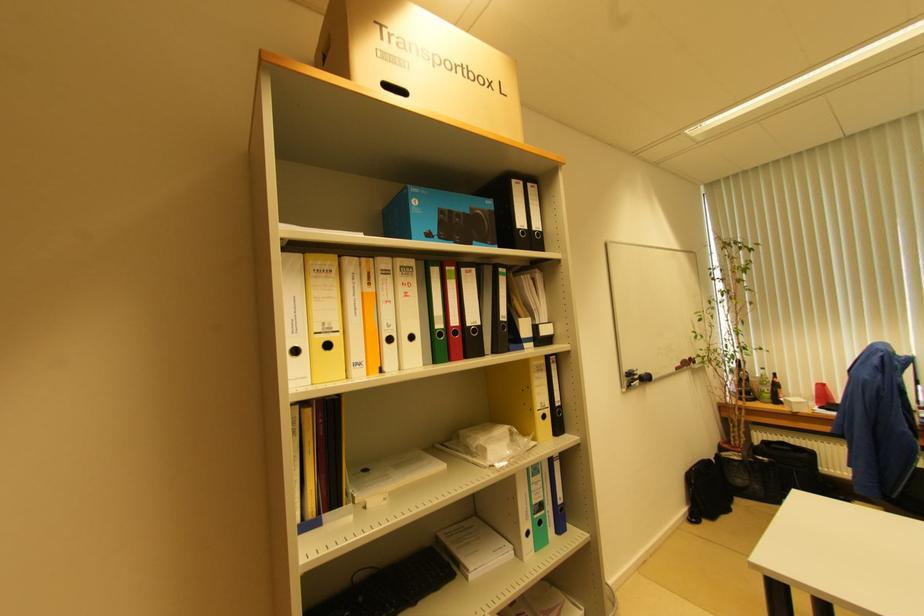
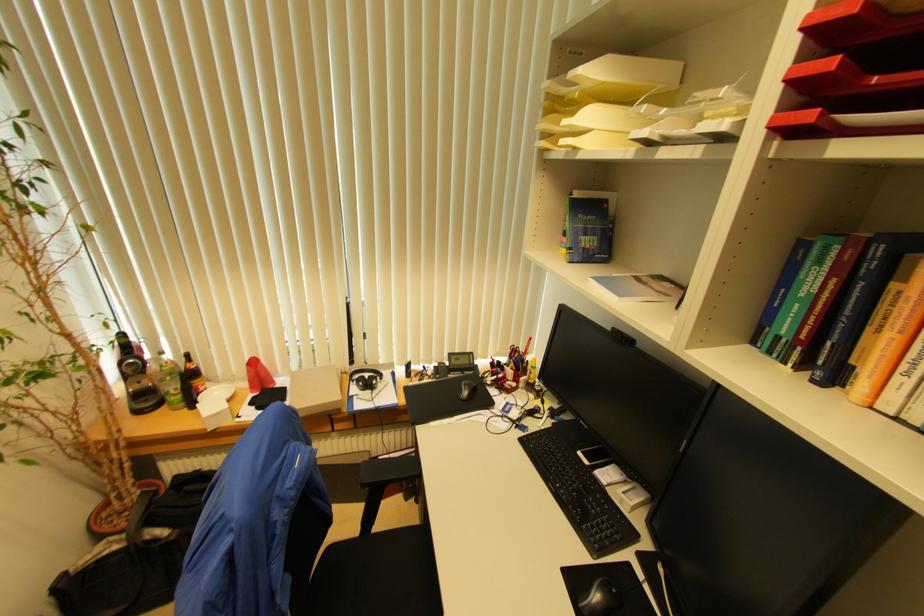
Where in the second image is the point corresponding to the point at 775,377 from the first image?

(188, 358)